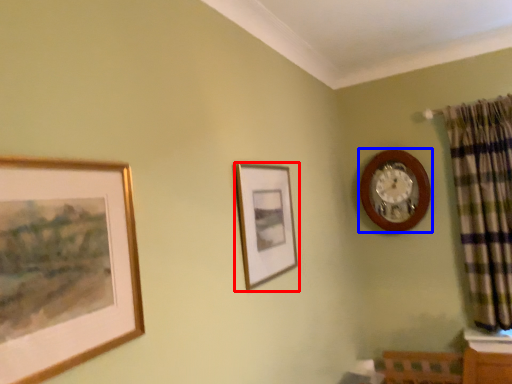
Question: Which of the following is the farthest to the observer, picture frame (highlighted by a red box) or wall clock (highlighted by a blue box)?

Choices:
 (A) picture frame
 (B) wall clock

Answer: (B)